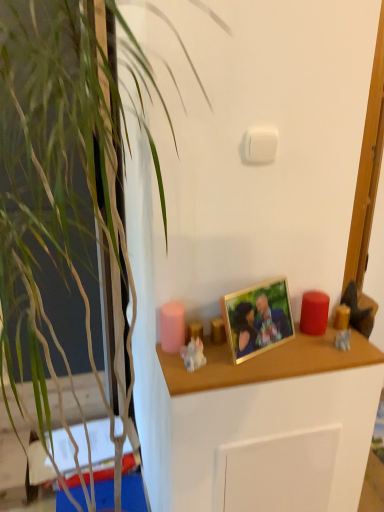
Identify the location of vacant space in between porcelain figurine at center, positioned as the first toy in front-to-back order, and translucent plastic figurine at right, which is counted as the 2th toy, starting from the left. This screenshot has width=384, height=512. (267, 356).